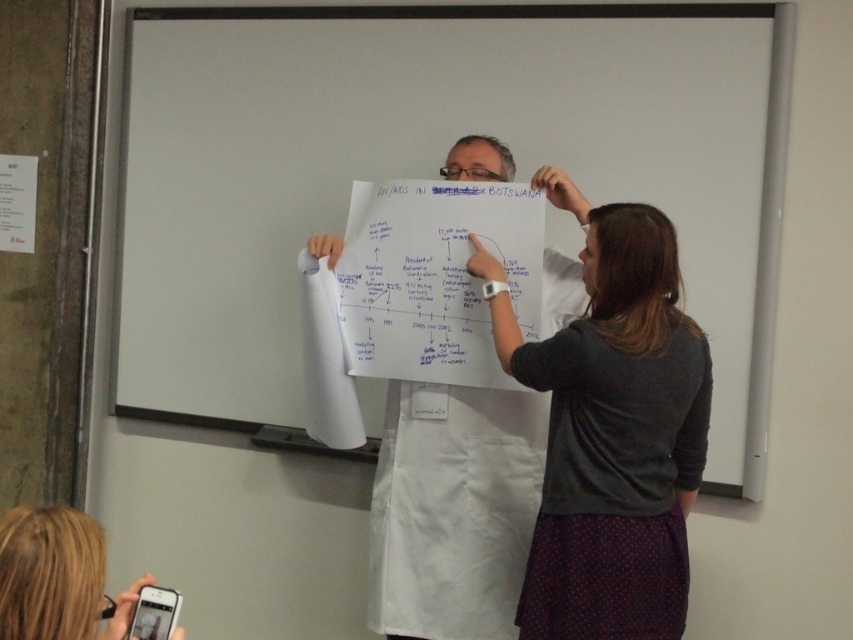
Does whiteboard at center have a smaller size compared to white paper at center?

No, whiteboard at center is not smaller than white paper at center.

What do you see at coordinates (431, 172) in the screenshot?
I see `whiteboard at center` at bounding box center [431, 172].

Does point (227, 348) come in front of point (395, 609)?

No, it is not.

Where is `whiteboard at center`? Image resolution: width=853 pixels, height=640 pixels. whiteboard at center is located at coordinates (431, 172).

Between point (624, 438) and point (57, 577), which one is positioned in front?

Point (57, 577) is more forward.

Is dark gray shirt at center below blonde hair at lower left?

Actually, dark gray shirt at center is above blonde hair at lower left.

Between point (595, 497) and point (62, 548), which one is positioned behind?

Point (595, 497)

Find the location of a particular element. dark gray shirt at center is located at coordinates (612, 436).

Which of these two, whiteboard at center or blonde hair at lower left, stands shorter?

Standing shorter between the two is blonde hair at lower left.

Find the location of a particular element. whiteboard at center is located at coordinates (431, 172).

I want to click on whiteboard at center, so click(x=431, y=172).